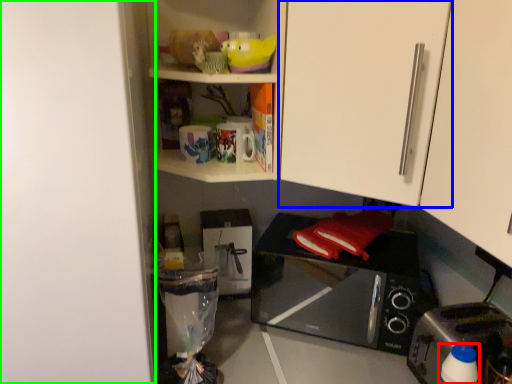
Question: Which object is positioned farthest from bottle (highlighted by a red box)? Select from cabinetry (highlighted by a blue box) and door (highlighted by a green box).

Choices:
 (A) cabinetry
 (B) door

Answer: (B)